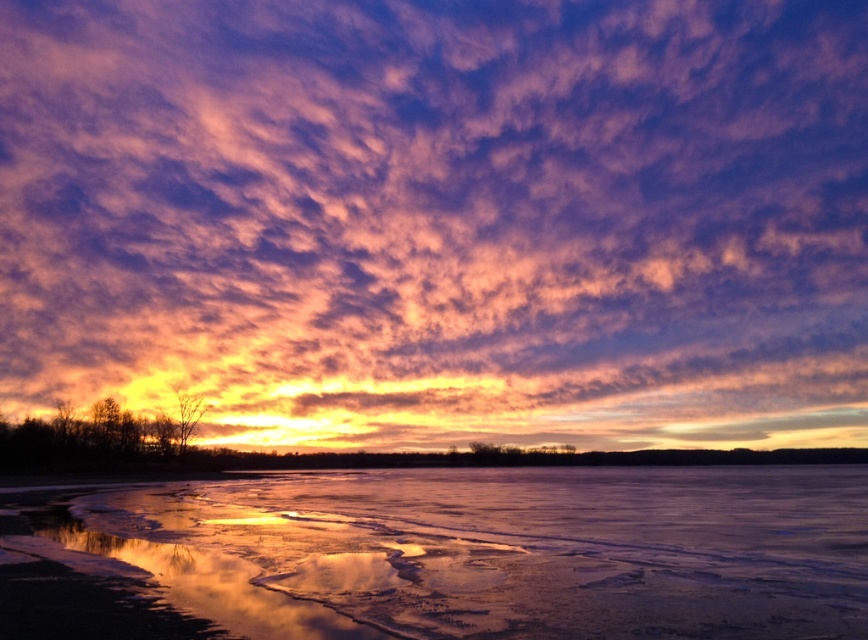
You are an artist trying to paint the sunset scene. You want to ensure the icy reflective water at lower center is positioned correctly relative to the purple cotton clouds at upper center. Based on the scene, which object should appear in front of the other?

The purple cotton clouds at upper center should appear in front of the icy reflective water at lower center because the icy reflective water at lower center is behind purple cotton clouds at upper center.

You are standing on the frozen lake and looking up at the sky. There is a point marked at coordinates point (x=439, y=218). Which object in the scene does this point belong to?

The point (x=439, y=218) is on purple cotton clouds at upper center.

You are an artist trying to paint the sunset scene. You need to know which object in the image is taller between the purple cotton clouds at upper center and the icy reflective water at lower center. Can you tell me?

The purple cotton clouds at upper center is much taller as icy reflective water at lower center, so the purple cotton clouds at upper center is taller.